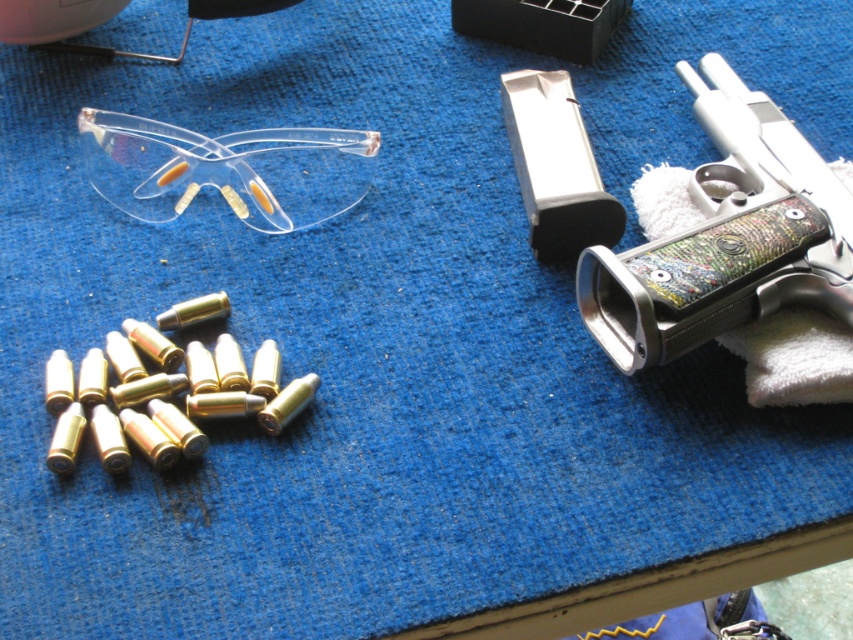
Can you confirm if polished silver revolver at right is wider than transparent plastic goggles at upper left?

Incorrect, polished silver revolver at right's width does not surpass transparent plastic goggles at upper left's.

Does point (732, 180) lie in front of point (125, 193)?

Yes, point (732, 180) is in front of point (125, 193).

Where is `polished silver revolver at right`? polished silver revolver at right is located at coordinates (727, 236).